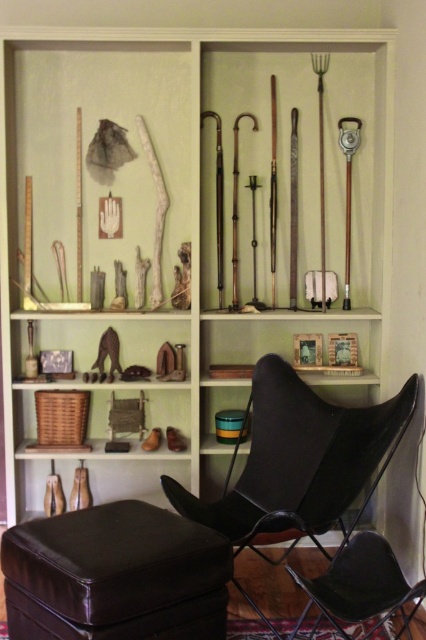
Does wooden tools at upper center appear under black leather chair at lower right?

No, wooden tools at upper center is not below black leather chair at lower right.

Can you confirm if wooden tools at upper center is bigger than black leather chair at lower right?

Indeed, wooden tools at upper center has a larger size compared to black leather chair at lower right.

Does point (5, 202) lie in front of point (305, 612)?

No, (5, 202) is behind (305, 612).

Locate an element on the screen. Image resolution: width=426 pixels, height=640 pixels. wooden tools at upper center is located at coordinates (198, 177).

Is brown leather ottoman at lower left taller than wooden figurines at center?

Yes, brown leather ottoman at lower left is taller than wooden figurines at center.

Is brown leather ottoman at lower left wider than wooden figurines at center?

Incorrect, brown leather ottoman at lower left's width does not surpass wooden figurines at center's.

Is point (163, 636) closer to camera compared to point (146, 340)?

Yes, point (163, 636) is closer to viewer.

Where is `brown leather ottoman at lower left`? The image size is (426, 640). brown leather ottoman at lower left is located at coordinates (115, 576).

Is wooden tools at upper center wider than wooden figurines at center?

Yes, wooden tools at upper center is wider than wooden figurines at center.

Where is `wooden tools at upper center`? wooden tools at upper center is located at coordinates (198, 177).